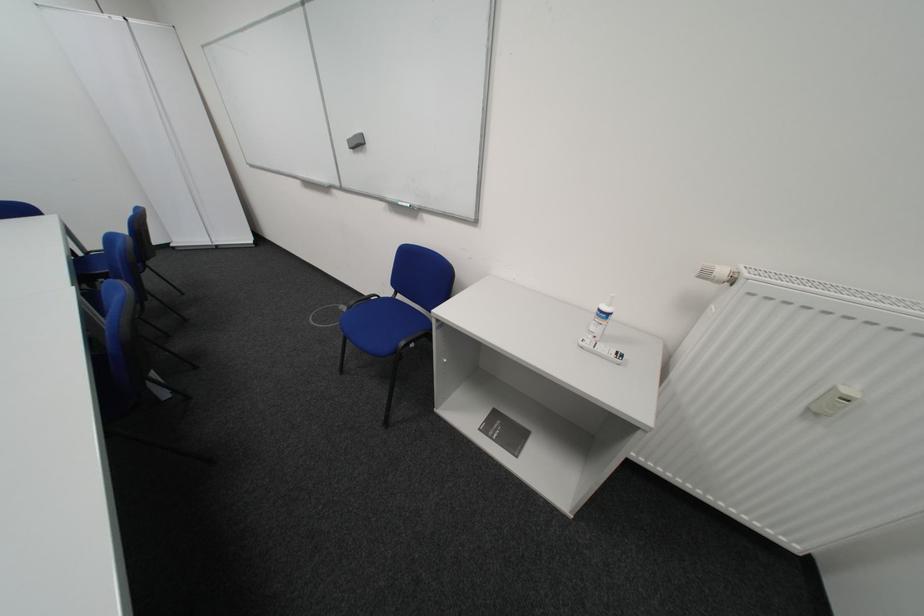
Locate an element on the screen. The image size is (924, 616). black manual book is located at coordinates (505, 432).